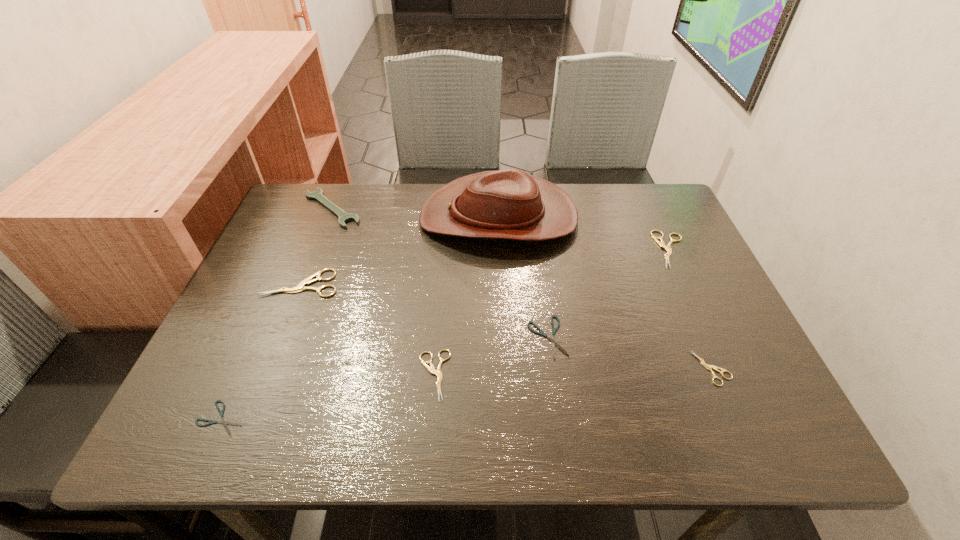
Image resolution: width=960 pixels, height=540 pixels. What are the coordinates of `brown cowboy hat` in the screenshot? It's located at (510, 204).

The height and width of the screenshot is (540, 960). What are the coordinates of `cowboy hat` in the screenshot? It's located at (510, 204).

Find the location of `the second tallest object`. the second tallest object is located at coordinates (344, 217).

Identify the location of the biggest beige shears. Image resolution: width=960 pixels, height=540 pixels. (300, 287).

Where is `the third nearest beige shears`? The width and height of the screenshot is (960, 540). the third nearest beige shears is located at coordinates (300, 287).

Locate an element on the screen. the second tallest shears is located at coordinates (661, 243).

Find the location of `the fifth shortest object`. the fifth shortest object is located at coordinates (661, 243).

This screenshot has height=540, width=960. I want to click on the fourth shortest shears, so click(438, 373).

You are a GUI agent. You are given a task and a screenshot of the screen. Output one action in this format:
    pyautogui.click(x=<x>, y=<y>)
    Task: Click on the third biggest beige shears
    This screenshot has width=960, height=540.
    Given the screenshot: What is the action you would take?
    pyautogui.click(x=438, y=373)

Identify the location of the smallest beige shears. (704, 364).